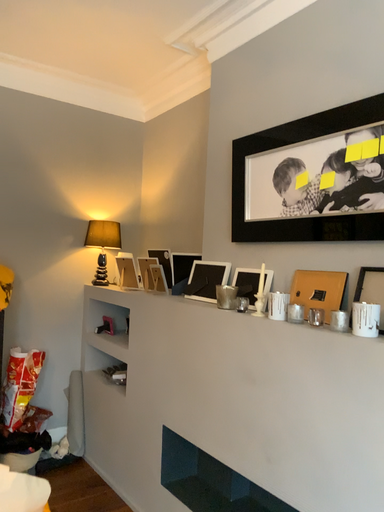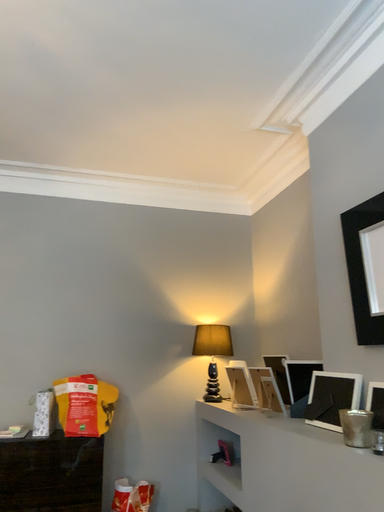
Question: How did the camera likely rotate when shooting the video?

Choices:
 (A) rotated right
 (B) rotated left

Answer: (B)